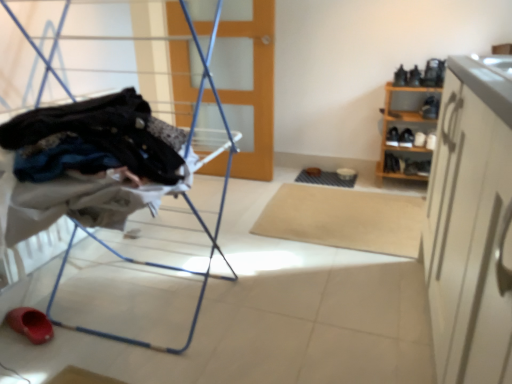
Find the location of a particular element. Image resolution: width=512 pixels, height=384 pixels. free space that is in between wooden at center and beige carpet at center is located at coordinates (262, 192).